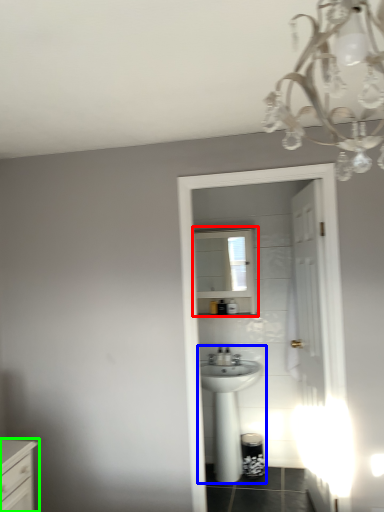
Question: Which object is positioned closest to medicine cabinet (highlighted by a red box)? Select from sink (highlighted by a blue box) and chest of drawers (highlighted by a green box).

Choices:
 (A) sink
 (B) chest of drawers

Answer: (A)